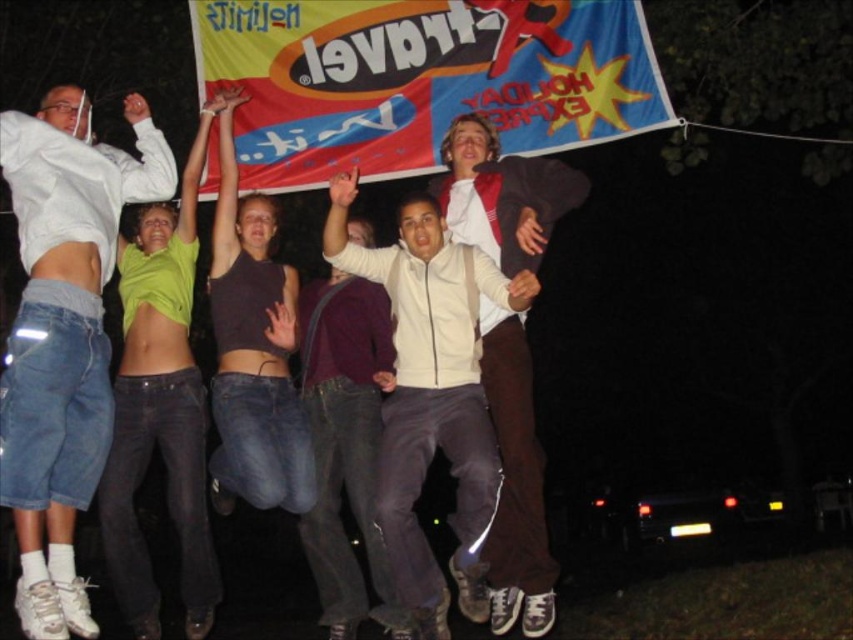
Question: Is white matte jacket at center bigger than brown leather jacket at center?

Choices:
 (A) yes
 (B) no

Answer: (A)

Question: Considering the real-world distances, which object is farthest from the brown leather jacket at center?

Choices:
 (A) white cotton hoodie at upper left
 (B) white matte jacket at center

Answer: (A)

Question: Which of these objects is positioned closest to the white cotton hoodie at upper left?

Choices:
 (A) brown leather jacket at center
 (B) white matte jacket at center
 (C) red fabric banner at upper center

Answer: (B)

Question: Does red fabric banner at upper center have a larger size compared to brown leather jacket at center?

Choices:
 (A) no
 (B) yes

Answer: (B)

Question: Observing the image, what is the correct spatial positioning of white cotton hoodie at upper left in reference to white matte jacket at center?

Choices:
 (A) below
 (B) above

Answer: (B)

Question: Which object appears farthest from the camera in this image?

Choices:
 (A) white cotton hoodie at upper left
 (B) white matte jacket at center
 (C) brown leather jacket at center
 (D) red fabric banner at upper center

Answer: (D)